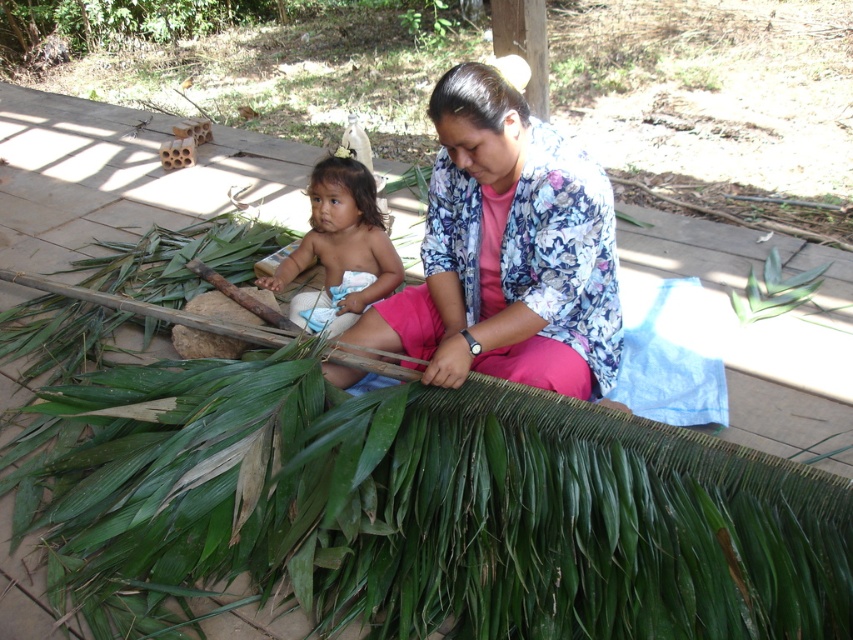
Measure the distance between floral-patterned fabric at center and camera.

They are 6.73 feet apart.

Is floral-patterned fabric at center bigger than green leafy plant at center?

Yes.

Between point (444, 157) and point (790, 298), which one is positioned behind?

The point (790, 298) is more distant.

Identify the location of floral-patterned fabric at center. (508, 252).

Does light blue cloth at center appear on the right side of green leafy plant at center?

In fact, light blue cloth at center is to the left of green leafy plant at center.

Which is behind, point (345, 305) or point (753, 301)?

The point (753, 301) is more distant.

The height and width of the screenshot is (640, 853). Identify the location of light blue cloth at center. (340, 250).

Who is positioned more to the right, floral-patterned fabric at center or light blue cloth at center?

floral-patterned fabric at center is more to the right.

Is point (466, 305) closer to camera compared to point (328, 204)?

Yes, point (466, 305) is closer to viewer.

Locate an element on the screen. Image resolution: width=853 pixels, height=640 pixels. floral-patterned fabric at center is located at coordinates (508, 252).